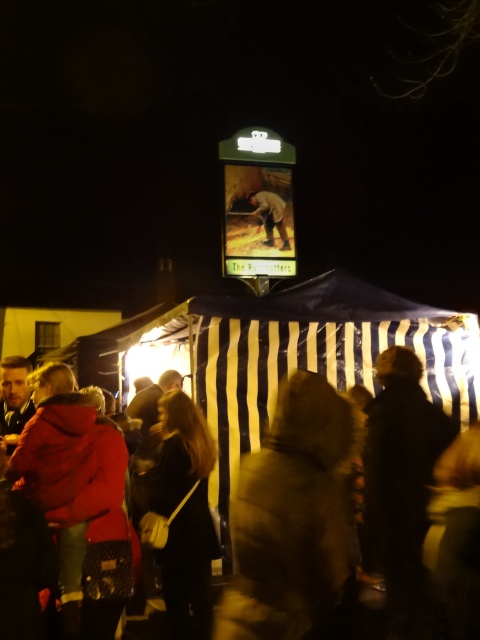
You are at the event and want to take a photo of both the brown fur coat at center and the brown leather jacket at center. Which one should you focus on first to ensure both are in the frame?

You should focus on the brown fur coat at center first since it is in front of the brown leather jacket at center, ensuring both are visible in the photo.

You are organizing a coat check at the event and need to place two jackets in adjacent spaces. The dark brown leather jacket at lower center and the brown leather jacket at center are both to be stored. Given their sizes, which jacket will require more space horizontally?

The brown leather jacket at center requires more horizontal space because its width is greater than the dark brown leather jacket at lower center.

You are at the event and need to retrieve your belongings from under your clothing items. You have a brown fur coat at center and a brown leather jacket at center. Which item should you lift first to access what is underneath?

You should lift the brown leather jacket at center first because the brown fur coat at center is located below it, so lifting the jacket will allow access to the fur coat and anything underneath.